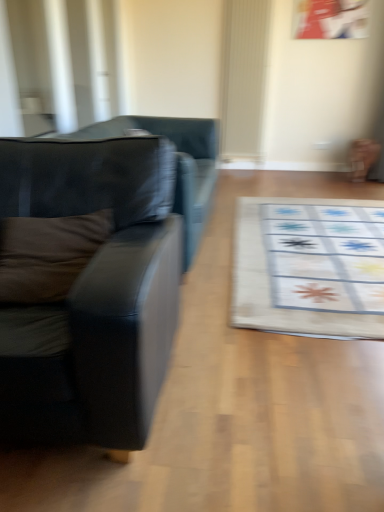
Locate an element on the screen. white fabric mat at center is located at coordinates (310, 266).

Measure the distance between brown fabric pillow at left and camera.

brown fabric pillow at left and camera are 4.37 feet apart.

What are the coordinates of `white fabric mat at center` in the screenshot? It's located at pos(310,266).

Who is bigger, white fabric mat at center or black leather couch at left, which is the 1th studio couch in front-to-back order?

With larger size is black leather couch at left, which is the 1th studio couch in front-to-back order.

Does white fabric mat at center touch black leather couch at left, which is the 1th studio couch in front-to-back order?

No, white fabric mat at center is not in contact with black leather couch at left, which is the 1th studio couch in front-to-back order.

Based on the photo, visually, is white fabric mat at center positioned to the left or to the right of black leather couch at left, which is the 1th studio couch in front-to-back order?

In the image, white fabric mat at center appears on the right side of black leather couch at left, which is the 1th studio couch in front-to-back order.

Which object is wider, white fabric mat at center or black leather couch at left, placed as the 2th studio couch when sorted from back to front?

white fabric mat at center.

Between white fabric mat at center and matte black couch at left, which ranks as the 2th studio couch in front-to-back order, which one has less height?

white fabric mat at center.

Considering the positions of points (376, 265) and (201, 215), is point (376, 265) farther from camera compared to point (201, 215)?

Yes, point (376, 265) is behind point (201, 215).

From a real-world perspective, is white fabric mat at center under matte black couch at left, arranged as the 1th studio couch when viewed from the back?

Indeed, from a real-world perspective, white fabric mat at center is positioned beneath matte black couch at left, arranged as the 1th studio couch when viewed from the back.

Is white fabric mat at center thinner than matte black couch at left, which ranks as the 2th studio couch in front-to-back order?

No, white fabric mat at center is not thinner than matte black couch at left, which ranks as the 2th studio couch in front-to-back order.

From the picture: From a real-world perspective, is matte black couch at left, which ranks as the 2th studio couch in front-to-back order, beneath brown fabric pillow at left?

Yes, from a real-world perspective, matte black couch at left, which ranks as the 2th studio couch in front-to-back order, is under brown fabric pillow at left.

Based on the photo, can you confirm if matte black couch at left, arranged as the 1th studio couch when viewed from the back, is taller than brown fabric pillow at left?

Correct, matte black couch at left, arranged as the 1th studio couch when viewed from the back, is much taller as brown fabric pillow at left.

Which object is further away from the camera, matte black couch at left, arranged as the 1th studio couch when viewed from the back, or brown fabric pillow at left?

matte black couch at left, arranged as the 1th studio couch when viewed from the back, is further away from the camera.

Could you tell me if white fabric mat at center is turned towards brown fabric pillow at left?

No, white fabric mat at center is not aimed at brown fabric pillow at left.

From a real-world perspective, is white fabric mat at center physically below brown fabric pillow at left?

Correct, in the physical world, white fabric mat at center is lower than brown fabric pillow at left.

In the image, is white fabric mat at center positioned in front of or behind brown fabric pillow at left?

Clearly, white fabric mat at center is behind brown fabric pillow at left.

From the image's perspective, which is below, white fabric mat at center or brown fabric pillow at left?

brown fabric pillow at left is shown below in the image.

The image size is (384, 512). I want to click on pillow lying behind the black leather couch at left, placed as the 2th studio couch when sorted from back to front, so click(48, 254).

Can you see black leather couch at left, which is the 1th studio couch in front-to-back order, touching brown fabric pillow at left?

No, black leather couch at left, which is the 1th studio couch in front-to-back order, is not with brown fabric pillow at left.

From the picture: From a real-world perspective, is black leather couch at left, placed as the 2th studio couch when sorted from back to front, on brown fabric pillow at left?

No.

Does black leather couch at left, which is the 1th studio couch in front-to-back order, have a larger size compared to brown fabric pillow at left?

Correct, black leather couch at left, which is the 1th studio couch in front-to-back order, is larger in size than brown fabric pillow at left.

Does brown fabric pillow at left have a lesser height compared to white fabric mat at center?

Incorrect, the height of brown fabric pillow at left does not fall short of that of white fabric mat at center.

Between brown fabric pillow at left and white fabric mat at center, which one has smaller width?

Thinner between the two is brown fabric pillow at left.

Where is `pillow on the left of white fabric mat at center`? This screenshot has width=384, height=512. pillow on the left of white fabric mat at center is located at coordinates (48, 254).

The height and width of the screenshot is (512, 384). In order to click on studio couch on the left of the brown fabric pillow at left in this screenshot , I will do `click(93, 294)`.

Looking at this image, considering the relative sizes of brown fabric pillow at left and black leather couch at left, placed as the 2th studio couch when sorted from back to front, in the image provided, is brown fabric pillow at left thinner than black leather couch at left, placed as the 2th studio couch when sorted from back to front,?

Yes.

The image size is (384, 512). I want to click on mat on the right of black leather couch at left, which is the 1th studio couch in front-to-back order, so click(x=310, y=266).

Where is `studio couch behind the white fabric mat at center`? studio couch behind the white fabric mat at center is located at coordinates (176, 164).

Estimate the real-world distances between objects in this image. Which object is closer to brown fabric pillow at left, white fabric mat at center or matte black couch at left, which ranks as the 2th studio couch in front-to-back order?

matte black couch at left, which ranks as the 2th studio couch in front-to-back order.

Considering their positions, is brown fabric pillow at left positioned closer to white fabric mat at center than matte black couch at left, which ranks as the 2th studio couch in front-to-back order?

matte black couch at left, which ranks as the 2th studio couch in front-to-back order, is closer to white fabric mat at center.

Considering their positions, is matte black couch at left, which ranks as the 2th studio couch in front-to-back order, positioned further to brown fabric pillow at left than black leather couch at left, placed as the 2th studio couch when sorted from back to front?

matte black couch at left, which ranks as the 2th studio couch in front-to-back order, lies further to brown fabric pillow at left than the other object.

From the image, which object appears to be nearer to white fabric mat at center, black leather couch at left, placed as the 2th studio couch when sorted from back to front, or matte black couch at left, which ranks as the 2th studio couch in front-to-back order?

matte black couch at left, which ranks as the 2th studio couch in front-to-back order, is positioned closer to the anchor white fabric mat at center.

Considering their positions, is brown fabric pillow at left positioned closer to black leather couch at left, placed as the 2th studio couch when sorted from back to front, than white fabric mat at center?

The object closer to black leather couch at left, placed as the 2th studio couch when sorted from back to front, is brown fabric pillow at left.

Looking at the image, which one is located closer to matte black couch at left, arranged as the 1th studio couch when viewed from the back, black leather couch at left, which is the 1th studio couch in front-to-back order, or brown fabric pillow at left?

black leather couch at left, which is the 1th studio couch in front-to-back order, is closer to matte black couch at left, arranged as the 1th studio couch when viewed from the back.

From the picture: Estimate the real-world distances between objects in this image. Which object is closer to brown fabric pillow at left, matte black couch at left, which ranks as the 2th studio couch in front-to-back order, or white fabric mat at center?

Based on the image, matte black couch at left, which ranks as the 2th studio couch in front-to-back order, appears to be nearer to brown fabric pillow at left.

Which object lies further to the anchor point brown fabric pillow at left, black leather couch at left, placed as the 2th studio couch when sorted from back to front, or white fabric mat at center?

white fabric mat at center is further to brown fabric pillow at left.

Where is `pillow between black leather couch at left, which is the 1th studio couch in front-to-back order, and white fabric mat at center from left to right`? This screenshot has width=384, height=512. pillow between black leather couch at left, which is the 1th studio couch in front-to-back order, and white fabric mat at center from left to right is located at coordinates click(x=48, y=254).

Find the location of a particular element. studio couch between brown fabric pillow at left and white fabric mat at center is located at coordinates (176, 164).

Where is `pillow between black leather couch at left, placed as the 2th studio couch when sorted from back to front, and matte black couch at left, arranged as the 1th studio couch when viewed from the back, along the z-axis`? The image size is (384, 512). pillow between black leather couch at left, placed as the 2th studio couch when sorted from back to front, and matte black couch at left, arranged as the 1th studio couch when viewed from the back, along the z-axis is located at coordinates (48, 254).

Locate an element on the screen. studio couch between black leather couch at left, which is the 1th studio couch in front-to-back order, and white fabric mat at center is located at coordinates (176, 164).